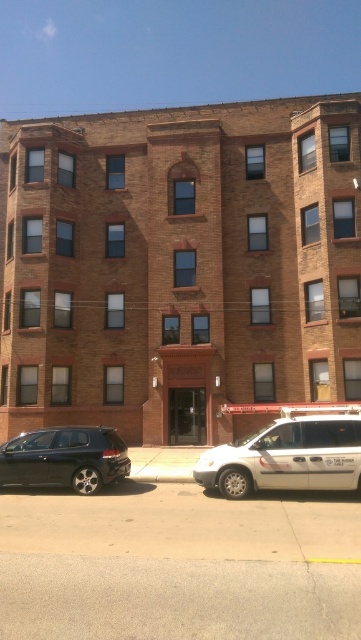
In the scene shown: Who is more distant from viewer, [268,458] or [106,458]?

The point [106,458] is behind.

Does white matte van at center have a smaller size compared to shiny black sedan at lower left?

Correct, white matte van at center occupies less space than shiny black sedan at lower left.

Locate an element on the screen. This screenshot has width=361, height=640. white matte van at center is located at coordinates (289, 452).

This screenshot has height=640, width=361. Find the location of `white matte van at center`. white matte van at center is located at coordinates (289, 452).